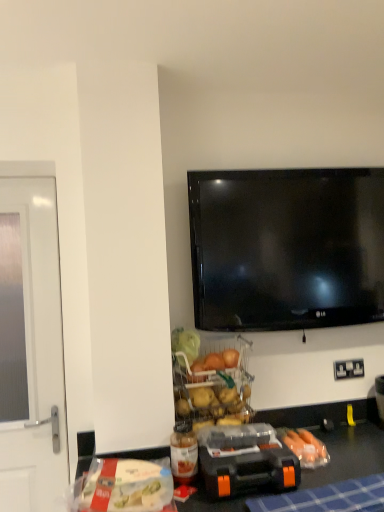
Question: From the image's perspective, relative to translucent plastic bottle at lower center, is clear glass screen door at left above or below?

Choices:
 (A) above
 (B) below

Answer: (A)

Question: Considering their positions, is clear glass screen door at left located in front of or behind translucent plastic bottle at lower center?

Choices:
 (A) behind
 (B) front

Answer: (A)

Question: Estimate the real-world distances between objects in this image. Which object is farther from the translucent plastic bottle at lower center?

Choices:
 (A) clear glass screen door at left
 (B) blue checkered tablecloth at lower center
 (C) white plastic bag at lower left
 (D) black plastic toolbox at lower center
 (E) white plastic electric outlet at lower right

Answer: (E)

Question: Considering the real-world distances, which object is closest to the white plastic electric outlet at lower right?

Choices:
 (A) translucent plastic bottle at lower center
 (B) white plastic bag at lower left
 (C) clear glass screen door at left
 (D) blue checkered tablecloth at lower center
 (E) black plastic toolbox at lower center

Answer: (E)